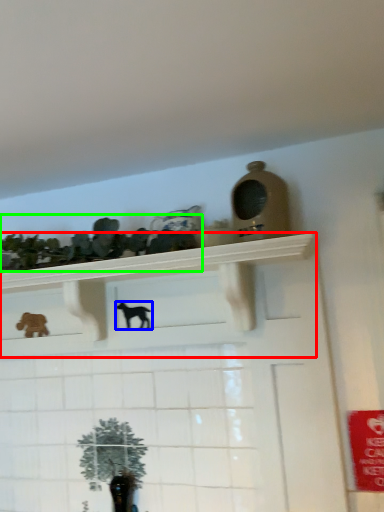
Question: Considering the real-world distances, which object is farthest from shelf (highlighted by a red box)? animal (highlighted by a blue box) or collection (highlighted by a green box)?

Choices:
 (A) animal
 (B) collection

Answer: (A)